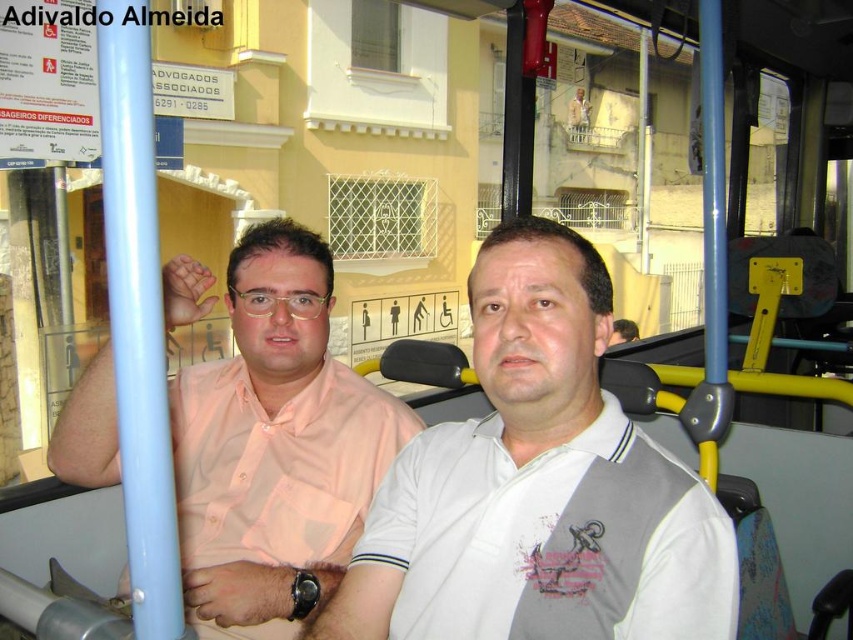
Can you confirm if white cotton shirt at center is bigger than pink shirt at left?

Incorrect, white cotton shirt at center is not larger than pink shirt at left.

How distant is white cotton shirt at center from pink shirt at left?

The distance of white cotton shirt at center from pink shirt at left is 20.45 inches.

Which is in front, point (515, 339) or point (83, 433)?

Point (515, 339) is in front.

The image size is (853, 640). I want to click on white cotton shirt at center, so click(525, 472).